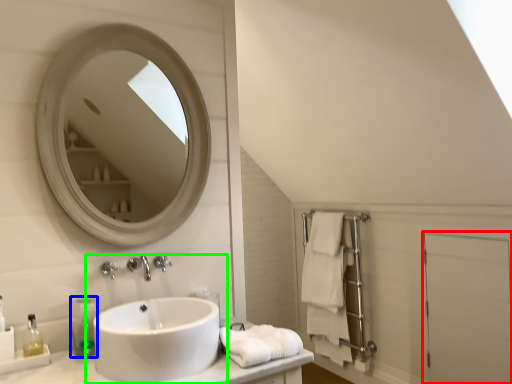
Question: Based on their relative distances, which object is nearer to screen door (highlighted by a red box)? Choose from soap dispenser (highlighted by a blue box) and sink (highlighted by a green box).

Choices:
 (A) soap dispenser
 (B) sink

Answer: (B)